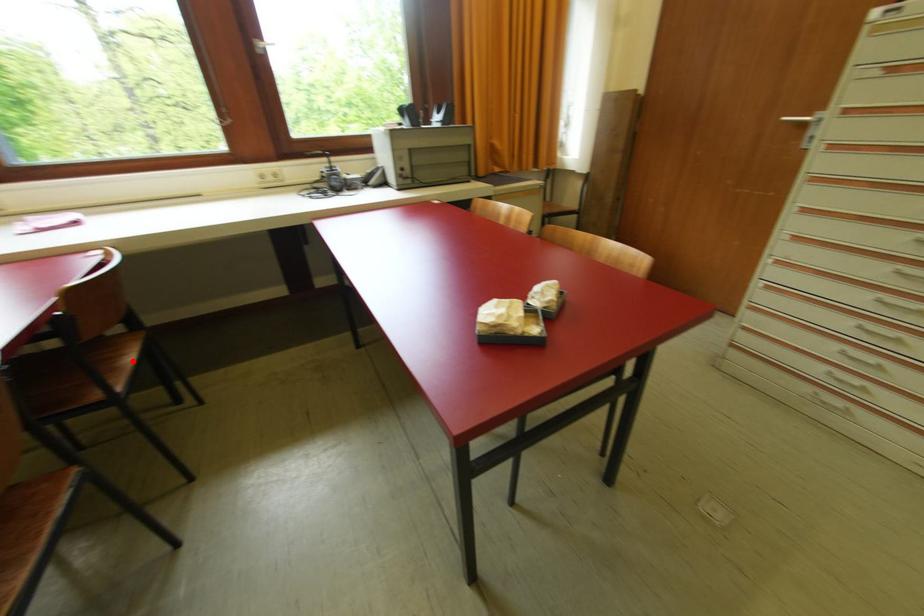
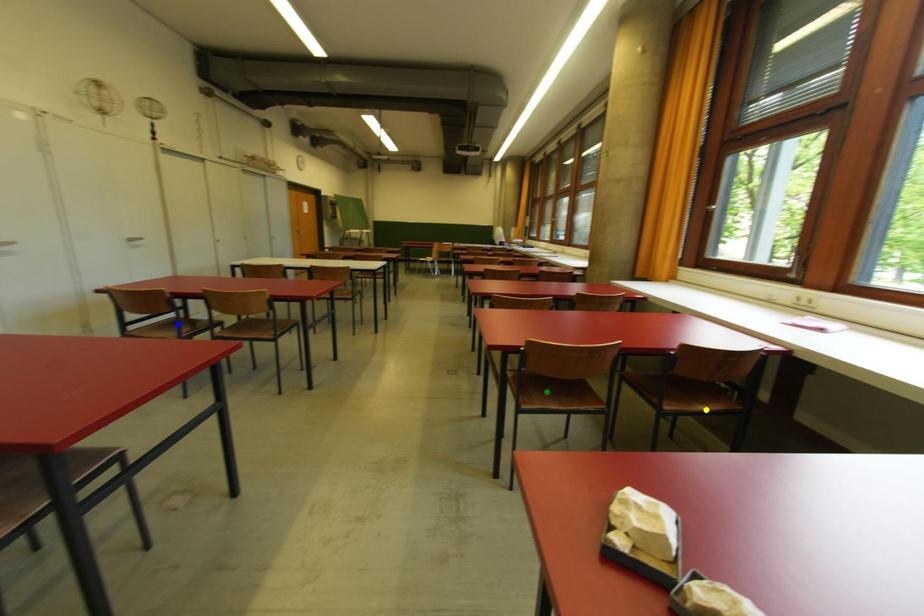
Question: I am providing you with two images of the same scene from different viewpoints. A red point is marked on the first image. You are given multiple points on the second image. Which point in image 2 is actually the same real-world point as the red point in image 1?

Choices:
 (A) green point
 (B) yellow point
 (C) blue point

Answer: (B)